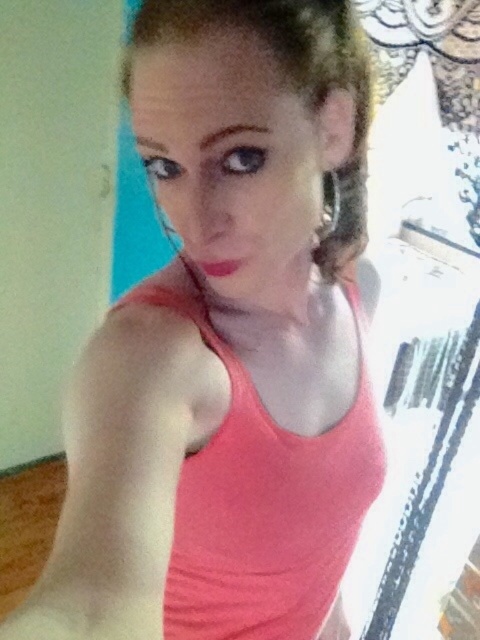
Based on the photo, you are a photographer setting up a shoot in this room. You have two items to place in the frame, the matte coral tank top at center and the matte pink lipstick at center. According to the scene, which item is positioned to the right of the other?

The matte coral tank top at center is to the right of the matte pink lipstick at center.

You are a fashion designer trying to decide which item to feature in your next collection. You have the matte coral tank top at center and the matte pink lipstick at center in front of you. Based on their sizes, which item would you choose if you want to highlight a larger piece?

The matte coral tank top at center is bigger than the matte pink lipstick at center, so you should choose the matte coral tank top at center to highlight a larger piece.

From the picture: You are a photographer setting up a shoot in this room. You have a matte coral tank top at center and a matte pink lipstick at center. The distance between them is crucial for your composition. Can you place them exactly 12 inches apart to match the scene?

The matte coral tank top at center is 12.17 inches away from the matte pink lipstick at center, so placing them exactly 12 inches apart would be slightly closer than the current distance in the scene.